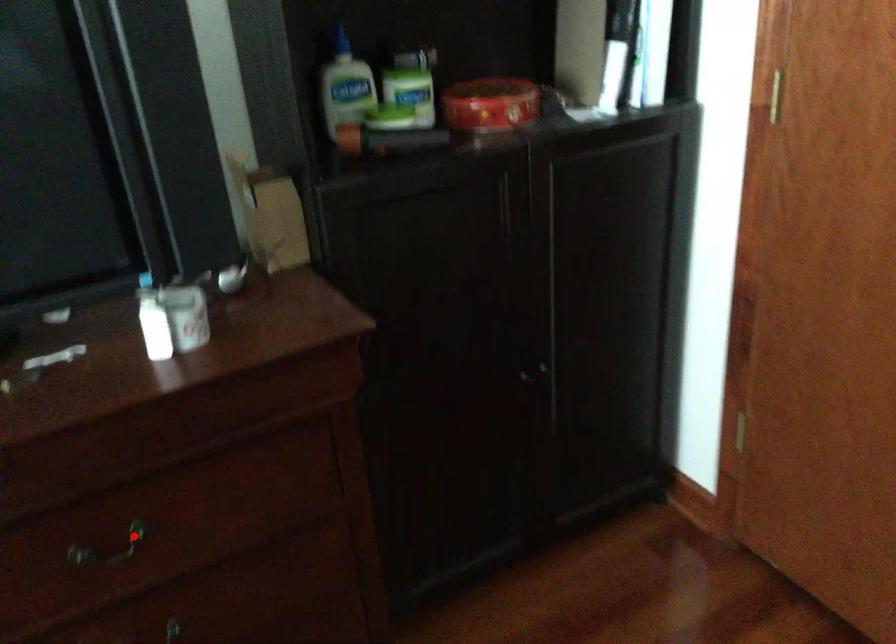
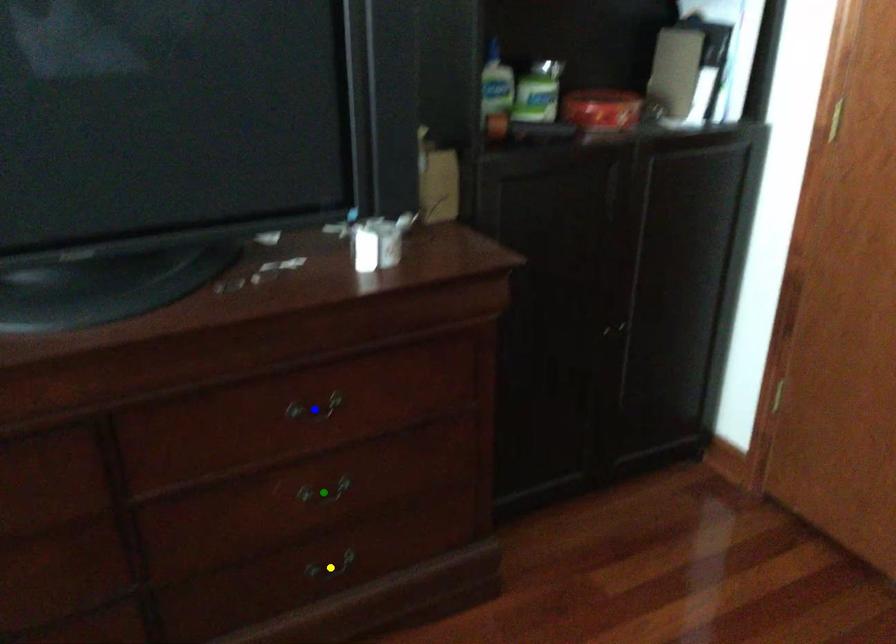
Question: I am providing you with two images of the same scene from different viewpoints. A red point is marked on the first image. You are given multiple points on the second image. In image 2, which mark is for the same physical point as the one in image 1?

Choices:
 (A) blue point
 (B) green point
 (C) yellow point

Answer: (A)